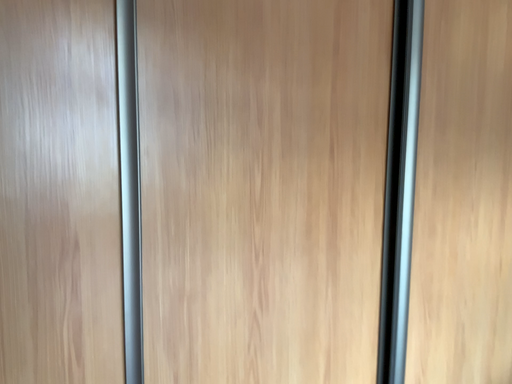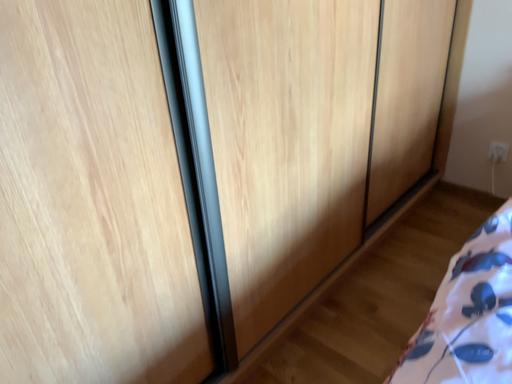
Question: How did the camera likely rotate when shooting the video?

Choices:
 (A) rotated left
 (B) rotated right

Answer: (B)